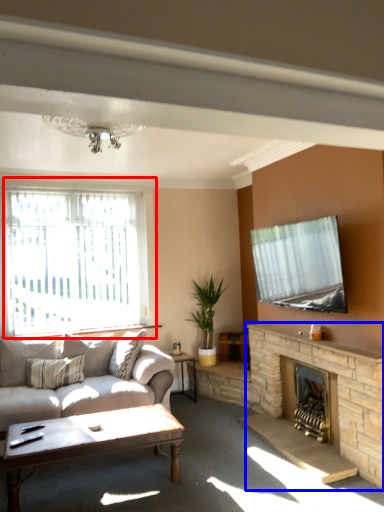
Question: Which object appears closest to the camera in this image, window (highlighted by a red box) or fireplace (highlighted by a blue box)?

Choices:
 (A) window
 (B) fireplace

Answer: (B)